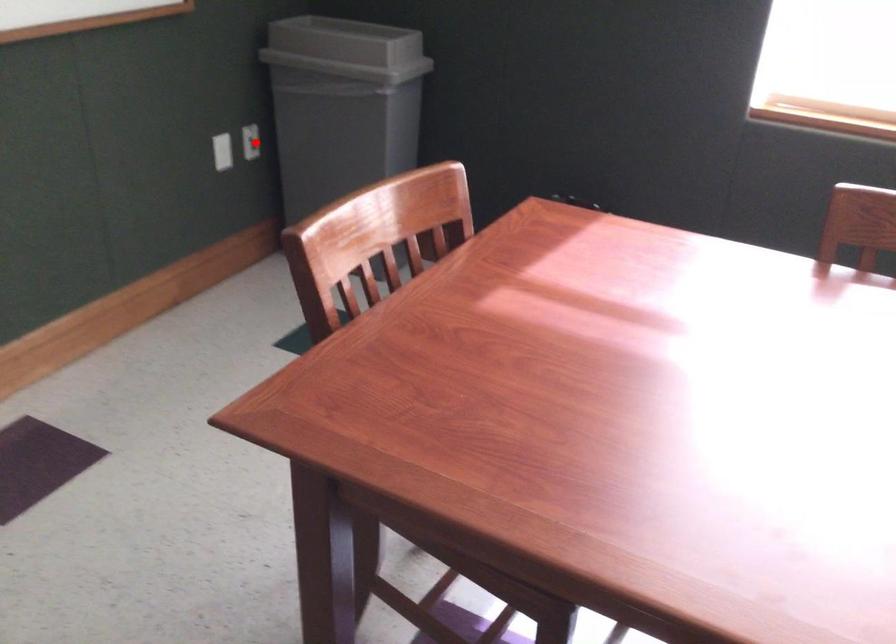
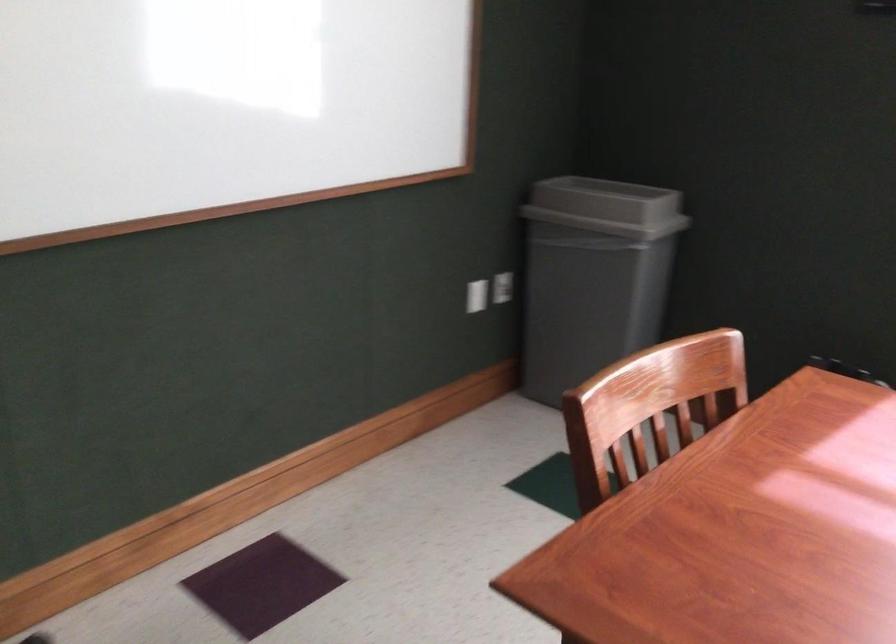
Where in the second image is the point corresponding to the highlighted location from the first image?

(503, 287)